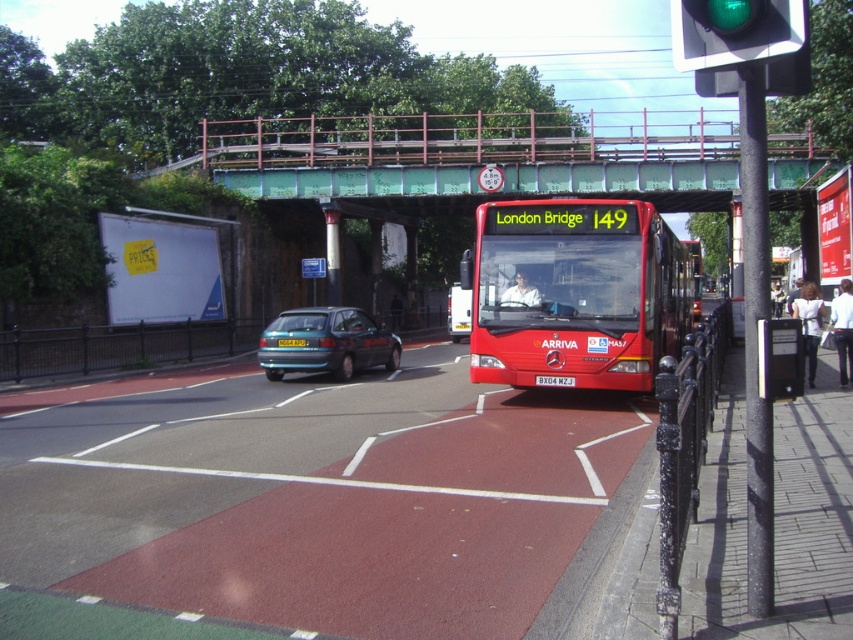
You are a delivery driver who needs to navigate through the city. You see two points on your GPS map labeled as point (704, 115) and point (370, 328). Which point is further away from your current position at the traffic light?

Point (704, 115) is behind point (370, 328), so it is further away from your current position at the traffic light.

You are a delivery driver navigating through the city. You see two points on your GPS map labeled as point (627, 260) and point (567, 384). Which point is closer to the red London bus labeled London Bridge 149?

Point (627, 260) is in front of point (567, 384), so it is closer to the red London bus labeled London Bridge 149.